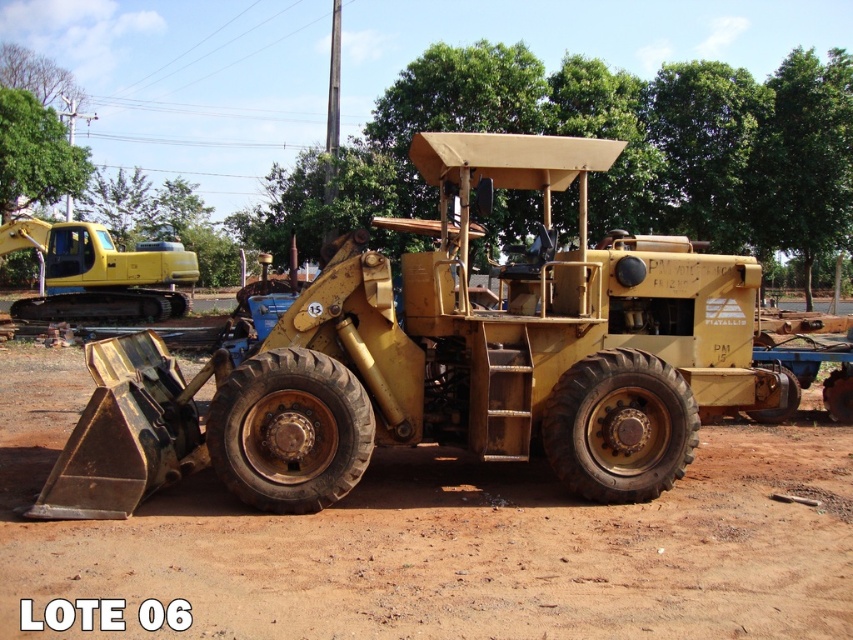
Can you confirm if yellow matte tractor at center is thinner than brown dirt field at center?

Correct, yellow matte tractor at center's width is less than brown dirt field at center's.

Between yellow matte tractor at center and brown dirt field at center, which one has more height?

With more height is yellow matte tractor at center.

Image resolution: width=853 pixels, height=640 pixels. What do you see at coordinates (440, 358) in the screenshot? I see `yellow matte tractor at center` at bounding box center [440, 358].

Locate an element on the screen. yellow matte tractor at center is located at coordinates (440, 358).

Based on the photo, can you confirm if brown dirt field at center is shorter than yellow rubber tracked tractor at upper left?

Correct, brown dirt field at center is not as tall as yellow rubber tracked tractor at upper left.

How distant is brown dirt field at center from yellow rubber tracked tractor at upper left?

brown dirt field at center is 16.62 meters away from yellow rubber tracked tractor at upper left.

Where is `brown dirt field at center`? The height and width of the screenshot is (640, 853). brown dirt field at center is located at coordinates (440, 541).

The width and height of the screenshot is (853, 640). What are the coordinates of `brown dirt field at center` in the screenshot? It's located at (440, 541).

Can you confirm if yellow matte tractor at center is thinner than yellow rubber tracked tractor at upper left?

Correct, yellow matte tractor at center's width is less than yellow rubber tracked tractor at upper left's.

Between yellow matte tractor at center and yellow rubber tracked tractor at upper left, which one has more height?

yellow rubber tracked tractor at upper left

Who is more distant from viewer, (497,141) or (99,260)?

Point (99,260)

Locate an element on the screen. yellow matte tractor at center is located at coordinates (440, 358).